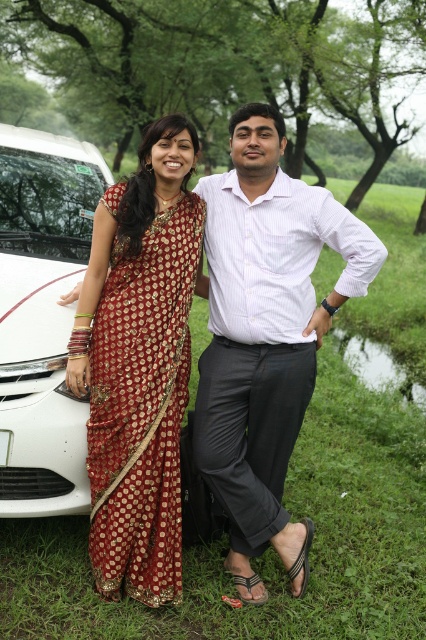
Question: Which point is closer to the camera?

Choices:
 (A) white striped shirt at center
 (B) white glossy car at left

Answer: (A)

Question: Is red silk saree at left bigger than white glossy car at left?

Choices:
 (A) no
 (B) yes

Answer: (A)

Question: Is white striped shirt at center further to camera compared to white glossy car at left?

Choices:
 (A) no
 (B) yes

Answer: (A)

Question: Which object appears farthest from the camera in this image?

Choices:
 (A) white glossy car at left
 (B) red silk saree at left
 (C) white striped shirt at center

Answer: (A)

Question: Is red silk saree at left positioned before white glossy car at left?

Choices:
 (A) yes
 (B) no

Answer: (A)

Question: Which object appears closest to the camera in this image?

Choices:
 (A) white glossy car at left
 (B) white striped shirt at center

Answer: (B)